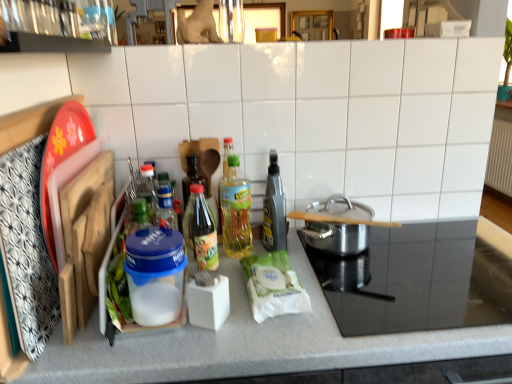
Where is `free space in front of polished stainless steel pot at center right`? This screenshot has height=384, width=512. free space in front of polished stainless steel pot at center right is located at coordinates (368, 283).